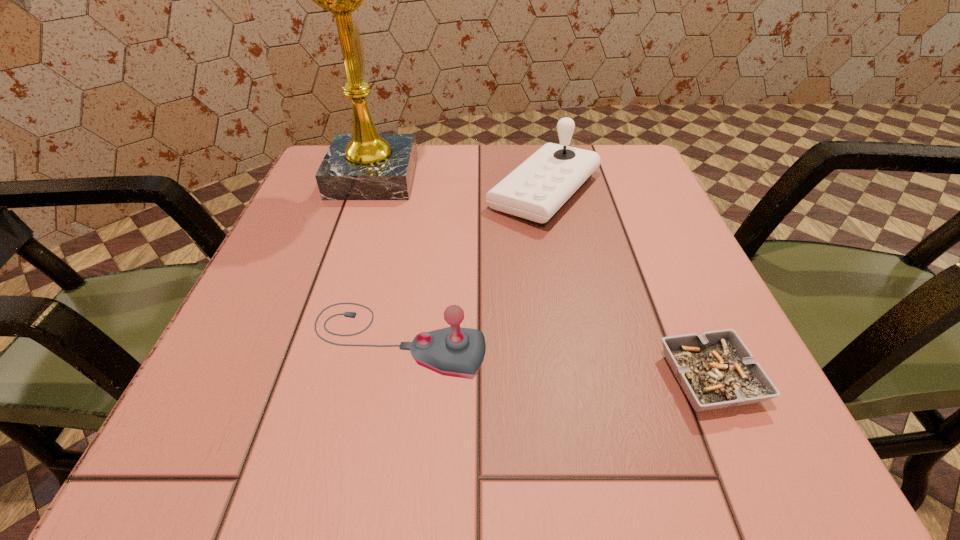
In the image, there is a desktop. In order to click on free space at the far edge in this screenshot , I will do `click(498, 177)`.

Identify the location of free region at the near edge of the desktop. (496, 424).

Find the location of a particular element. The image size is (960, 540). free region at the left edge of the desktop is located at coordinates (300, 216).

Locate an element on the screen. The width and height of the screenshot is (960, 540). vacant region at the right edge of the desktop is located at coordinates (663, 249).

The image size is (960, 540). I want to click on vacant space at the far right corner, so click(631, 160).

Identify the location of free space between the taller joystick and the shortest object. pyautogui.click(x=627, y=285).

Find the location of a particular element. The height and width of the screenshot is (540, 960). unoccupied area between the award and the right joystick is located at coordinates (459, 185).

The width and height of the screenshot is (960, 540). Identify the location of vacant space that is in between the ashtray and the right joystick. (627, 285).

At what (x,y) coordinates should I click in order to perform the action: click on unoccupied area between the tallest object and the left joystick. Please return your answer as a coordinate pair (x, y). This screenshot has width=960, height=540. Looking at the image, I should click on (385, 259).

Locate an element on the screen. The width and height of the screenshot is (960, 540). vacant region between the shortest object and the tallest object is located at coordinates (541, 278).